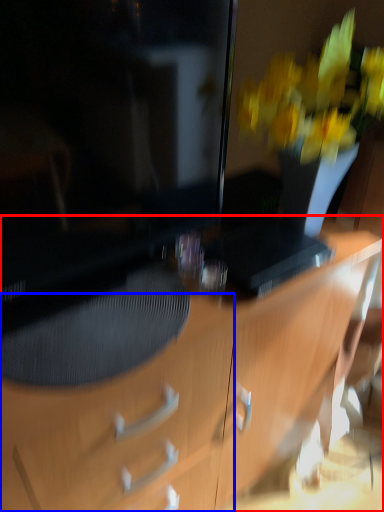
Question: Which point is further to the camera, desk (highlighted by a red box) or drawer (highlighted by a blue box)?

Choices:
 (A) desk
 (B) drawer

Answer: (B)